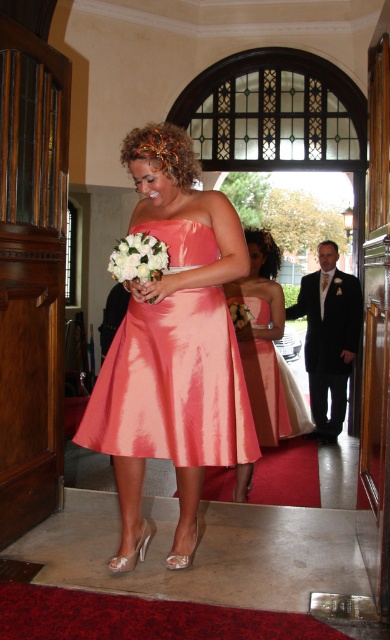
Is shiny pink dress at center to the right of white matte bouquet at center from the viewer's perspective?

Correct, you'll find shiny pink dress at center to the right of white matte bouquet at center.

Does shiny pink dress at center have a larger size compared to white matte bouquet at center?

Yes, shiny pink dress at center is bigger than white matte bouquet at center.

At what (x,y) coordinates should I click in order to perform the action: click on shiny pink dress at center. Please return your answer as a coordinate pair (x, y). The height and width of the screenshot is (640, 390). Looking at the image, I should click on (267, 346).

Between point (164, 444) and point (239, 324), which one is positioned behind?

Positioned behind is point (239, 324).

Where is `coral satin dress at center`? coral satin dress at center is located at coordinates (173, 385).

Who is lower down, coral satin dress at center or shiny pink dress at center?

shiny pink dress at center is lower down.

Locate an element on the screen. This screenshot has height=640, width=390. coral satin dress at center is located at coordinates (173, 385).

Who is more distant from viewer, (122, 420) or (248, 385)?

Point (248, 385)

Locate an element on the screen. This screenshot has width=390, height=640. coral satin dress at center is located at coordinates (173, 385).